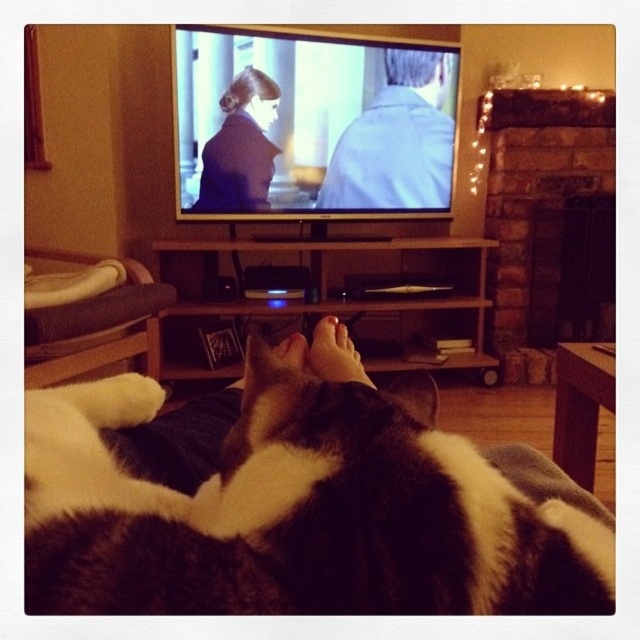
You are a photographer trying to capture a closeup of the black and white fur at lower center. Your camera has a minimum focusing distance of 10 inches. Can you take the photo without moving the camera or the subject?

The black and white fur at lower center is 9.52 inches away from the camera, which is closer than the minimum focusing distance of 10 inches. Therefore, you cannot take a clear closeup without moving the camera or the subject closer.

You are watching a movie on the TV and see two characters wearing a light blue shirt at upper center and a matte black coat at upper left. Which character is taller?

The light blue shirt at upper center is taller than the matte black coat at upper left.

You are a movie director analyzing the scene on the TV screen. You notice the light blue shirt at upper center and the matte black coat at upper left. Which clothing item is covering part of the other?

The light blue shirt at upper center is positioned over the matte black coat at upper left, so it is covering part of it.